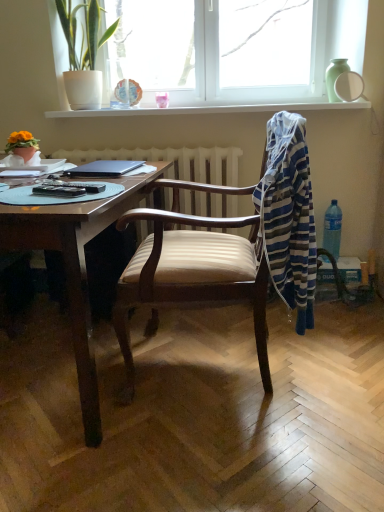
What are the coordinates of `vacant space in wooden chair at center (from a real-world perspective)` in the screenshot? It's located at (206, 369).